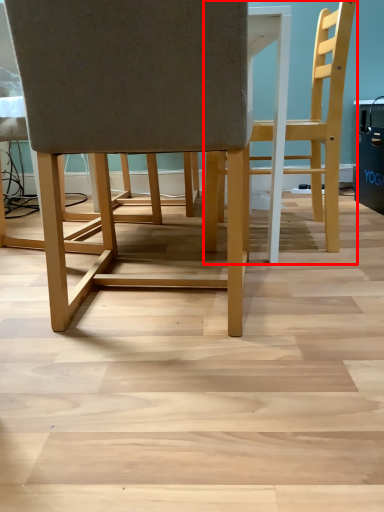
Question: From the image's perspective, what is the correct spatial relationship of chair (annotated by the red box) in relation to chair?

Choices:
 (A) above
 (B) below

Answer: (A)